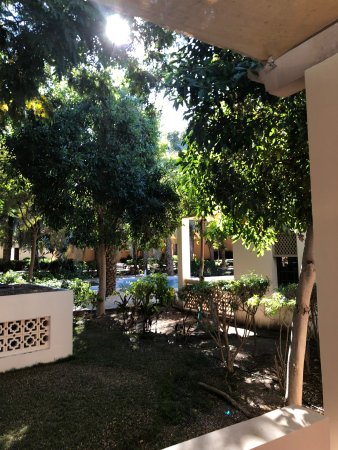
Where is `the front wall`? The height and width of the screenshot is (450, 338). the front wall is located at coordinates (285, 427).